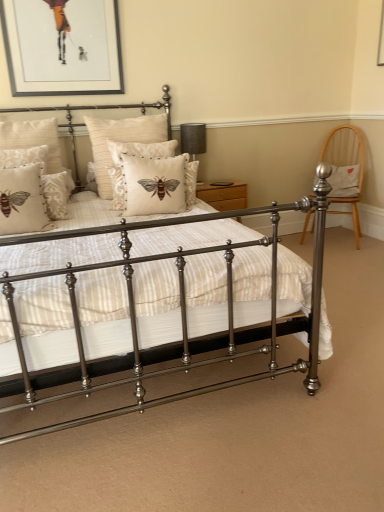
Question: From a real-world perspective, is black fabric table lamp at upper center physically located above or below matte cream pillow at left, which is counted as the 4th pillow, starting from the left?

Choices:
 (A) above
 (B) below

Answer: (A)

Question: Visually, is black fabric table lamp at upper center positioned to the left or to the right of matte cream pillow at left, which is counted as the 4th pillow, starting from the left?

Choices:
 (A) right
 (B) left

Answer: (A)

Question: Estimate the real-world distances between objects in this image. Which object is closer to the wooden chair with cushion at right?

Choices:
 (A) white fabric pillow at right, the seventh pillow when ordered from left to right
 (B) beige textured pillow with bee design at center, the second pillow when ordered from right to left
 (C) beige damask pillow at left, which is the first pillow in left-to-right order
 (D) black fabric table lamp at upper center
 (E) metallic bed at center

Answer: (A)

Question: Which object is positioned closest to the white fabric pillow at right, the seventh pillow when ordered from left to right?

Choices:
 (A) matte black picture frame at upper left
 (B) beige textured pillow with bee design at center, which ranks as the 5th pillow in left-to-right order
 (C) beige embroidered pillow at left, the third pillow viewed from the left
 (D) beige damask pillow at left, arranged as the seventh pillow when viewed from the right
 (E) beige textured pillow at left, which is counted as the 2th pillow, starting from the left

Answer: (B)